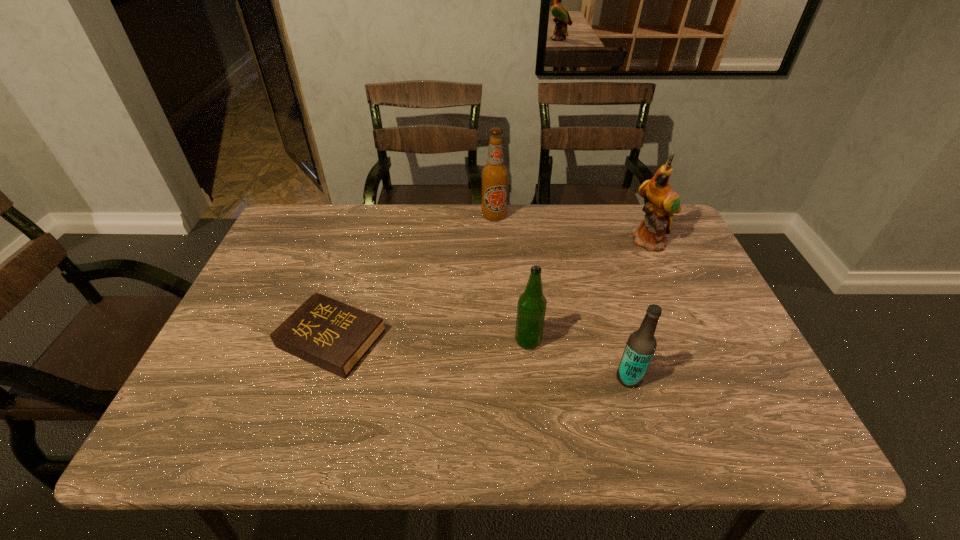
Identify the location of object at the left edge. This screenshot has height=540, width=960. (334, 336).

Identify the location of object that is at the right edge. The image size is (960, 540). (663, 202).

Identify the location of object located in the far right corner section of the desktop. The image size is (960, 540). (663, 202).

You are a GUI agent. You are given a task and a screenshot of the screen. Output one action in this format:
    pyautogui.click(x=<x>, y=<y>)
    Task: Click on the vacant space at the far edge of the desktop
    The image size is (960, 540).
    Given the screenshot: What is the action you would take?
    pyautogui.click(x=391, y=219)

This screenshot has width=960, height=540. What are the coordinates of `free space at the near edge of the desktop` in the screenshot? It's located at (632, 444).

This screenshot has width=960, height=540. What are the coordinates of `vacant space at the left edge of the desktop` in the screenshot? It's located at (234, 346).

In order to click on free space at the right edge of the desktop in this screenshot , I will do `click(764, 390)`.

Locate an element on the screen. vacant space at the far right corner of the desktop is located at coordinates (636, 206).

The height and width of the screenshot is (540, 960). In order to click on empty location between the farthest object and the rightmost beer bottle in this screenshot , I will do `click(562, 297)`.

This screenshot has width=960, height=540. I want to click on free spot between the hardback book and the parrot, so click(492, 290).